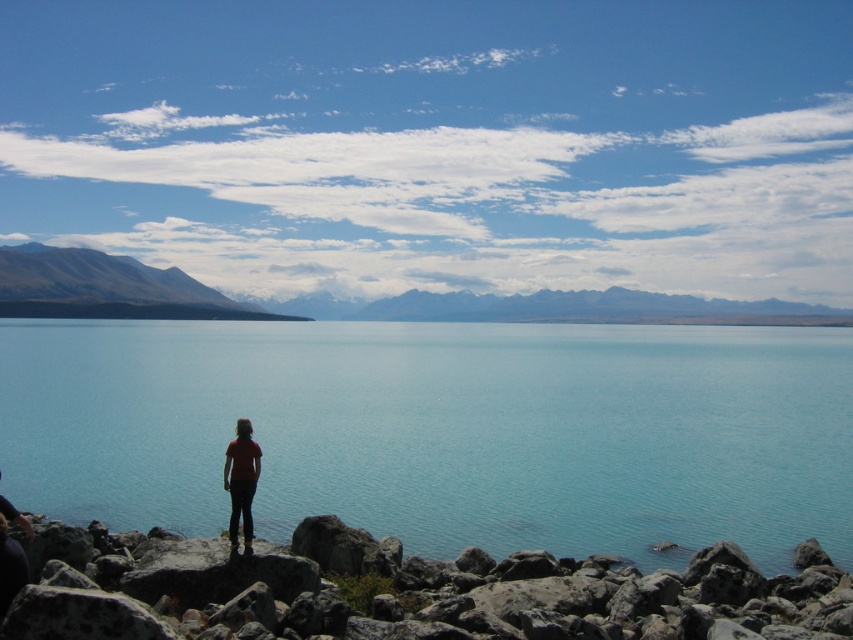
Is snowy rocky mountain at left shorter than matte red shirt at center?

No, snowy rocky mountain at left is not shorter than matte red shirt at center.

Is the position of snowy rocky mountain at left less distant than that of matte red shirt at center?

No.

Who is more distant from viewer, [204,292] or [223,468]?

The point [204,292] is more distant.

I want to click on snowy rocky mountain at left, so click(106, 288).

Who is positioned more to the right, clear blue water at center or gray rough rock at lower center?

clear blue water at center

Can you confirm if clear blue water at center is smaller than gray rough rock at lower center?

No.

Identify the location of clear blue water at center. pyautogui.click(x=442, y=432).

Who is more forward, (245, 586) or (212, 317)?

Point (245, 586) is more forward.

Identify the location of gray rough rock at lower center. (407, 593).

This screenshot has width=853, height=640. I want to click on gray rough rock at lower center, so click(407, 593).